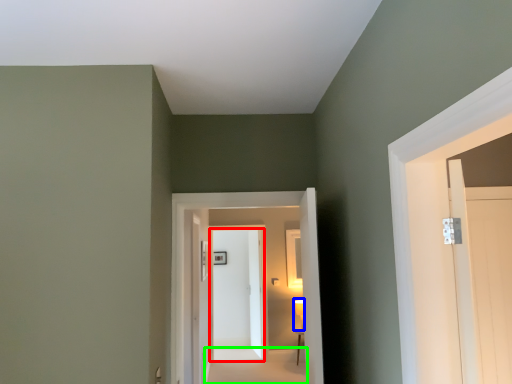
Question: Considering the real-world distances, which object is closest to door (highlighted by a red box)? light fixture (highlighted by a blue box) or path (highlighted by a green box).

Choices:
 (A) light fixture
 (B) path

Answer: (B)